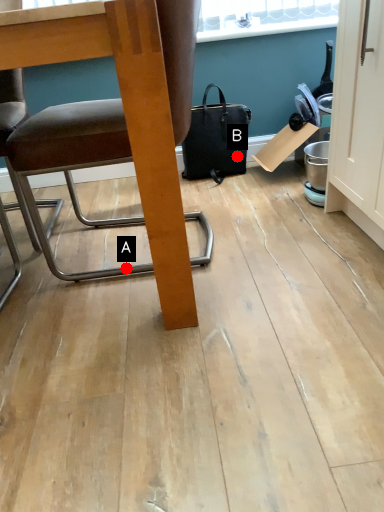
Question: Two points are circled on the image, labeled by A and B beside each circle. Which point appears closest to the camera in this image?

Choices:
 (A) A is closer
 (B) B is closer

Answer: (A)